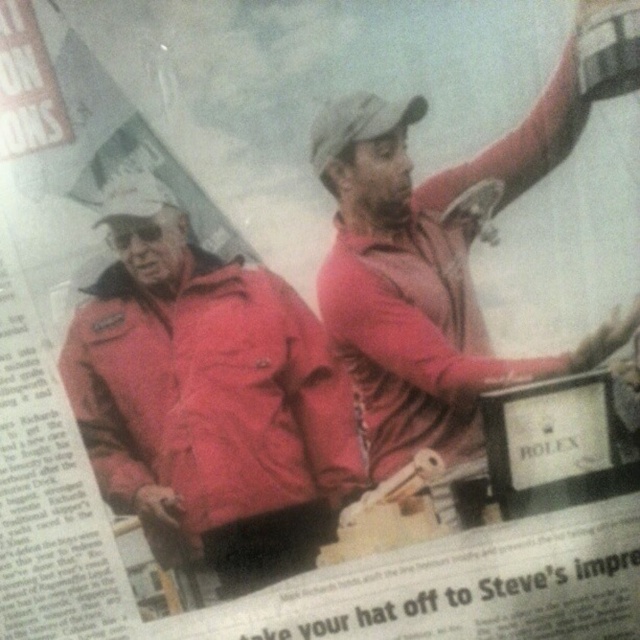
Question: Is matte red jacket at center closer to the viewer compared to matte red shirt at upper right?

Choices:
 (A) no
 (B) yes

Answer: (A)

Question: Is matte red jacket at center wider than matte red shirt at upper right?

Choices:
 (A) no
 (B) yes

Answer: (A)

Question: Which point appears farthest from the camera in this image?

Choices:
 (A) (628, 22)
 (B) (125, 348)

Answer: (B)

Question: Where is matte red jacket at center located in relation to matte red shirt at upper right in the image?

Choices:
 (A) left
 (B) right

Answer: (A)